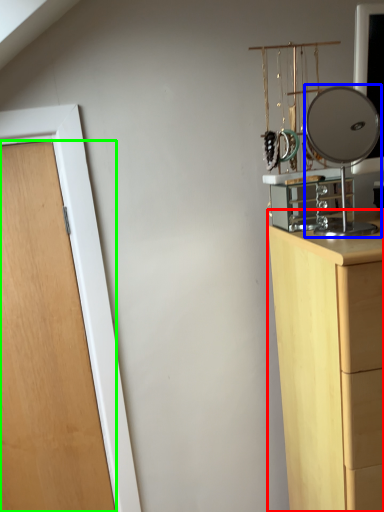
Question: Which object is the closest to the chest of drawers (highlighted by a red box)? Choose among these: mirror (highlighted by a blue box) or door (highlighted by a green box).

Choices:
 (A) mirror
 (B) door

Answer: (B)